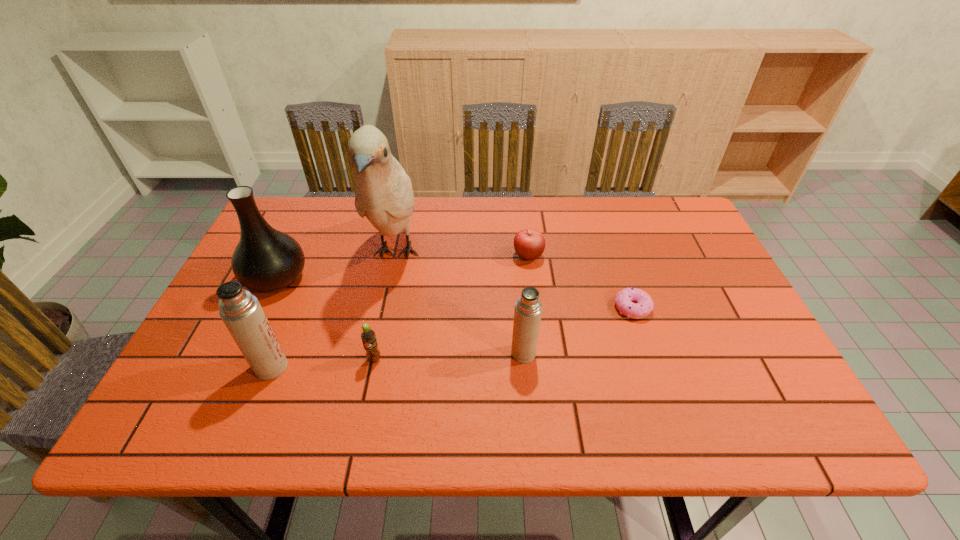
Locate an element on the screen. The height and width of the screenshot is (540, 960). object that is positioned at the near left corner is located at coordinates (241, 312).

Locate an element on the screen. free spot at the far edge of the desktop is located at coordinates (430, 211).

You are a GUI agent. You are given a task and a screenshot of the screen. Output one action in this format:
    pyautogui.click(x=<x>, y=<y>)
    Task: Click on the vacant space at the left edge of the desktop
    
    Given the screenshot: What is the action you would take?
    pyautogui.click(x=206, y=326)

Find the location of a particular element. This screenshot has width=960, height=540. free region at the right edge of the desktop is located at coordinates (683, 288).

The image size is (960, 540). Identify the location of vacant space that's between the right thermos bottle and the soda. (449, 356).

Find the location of a particular element. free point between the fifth tallest object and the tallest object is located at coordinates (385, 306).

Where is `free space that is in between the third shortest object and the tallest object`? This screenshot has width=960, height=540. free space that is in between the third shortest object and the tallest object is located at coordinates (385, 306).

Identify the location of vacant space that is in between the apple and the left thermos bottle. pos(399,312).

The height and width of the screenshot is (540, 960). What are the coordinates of `vacant space in between the parakeet and the taller thermos bottle` in the screenshot? It's located at (334, 310).

The image size is (960, 540). In order to click on vacant region between the vase and the apple in this screenshot , I will do `click(402, 267)`.